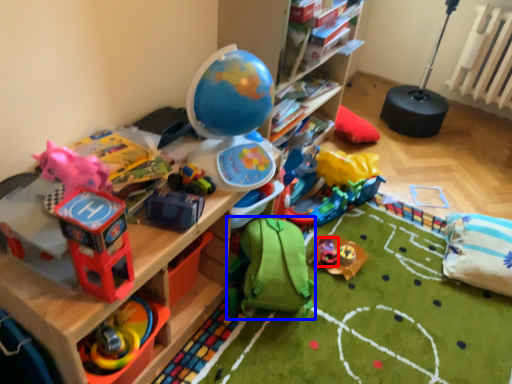
Question: Which object appears farthest to the camera in this image, toy (highlighted by a red box) or toy (highlighted by a blue box)?

Choices:
 (A) toy
 (B) toy

Answer: (A)